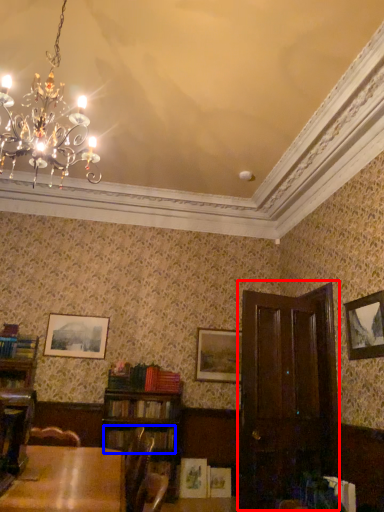
Question: Which object appears closest to the camera in this image, armoire (highlighted by a red box) or book (highlighted by a blue box)?

Choices:
 (A) armoire
 (B) book

Answer: (A)